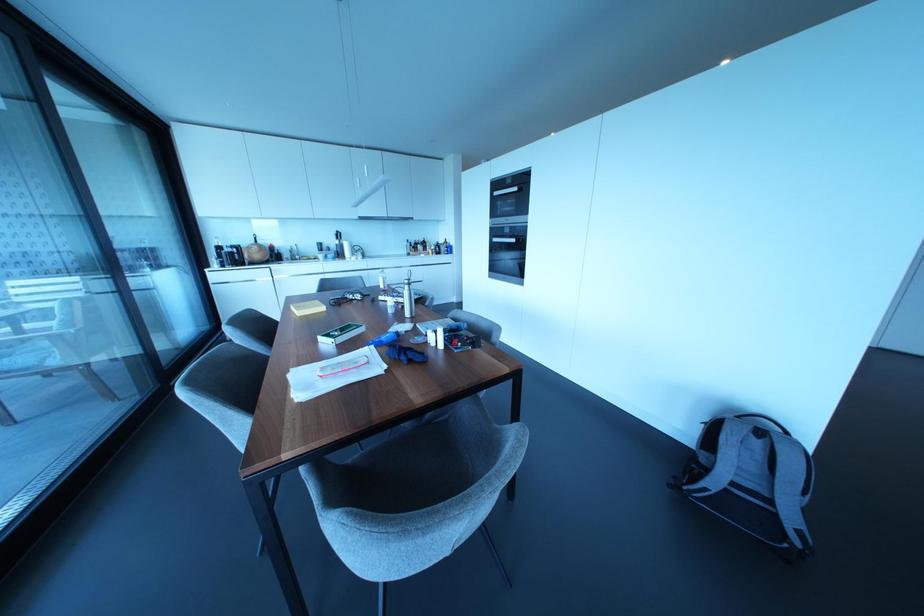
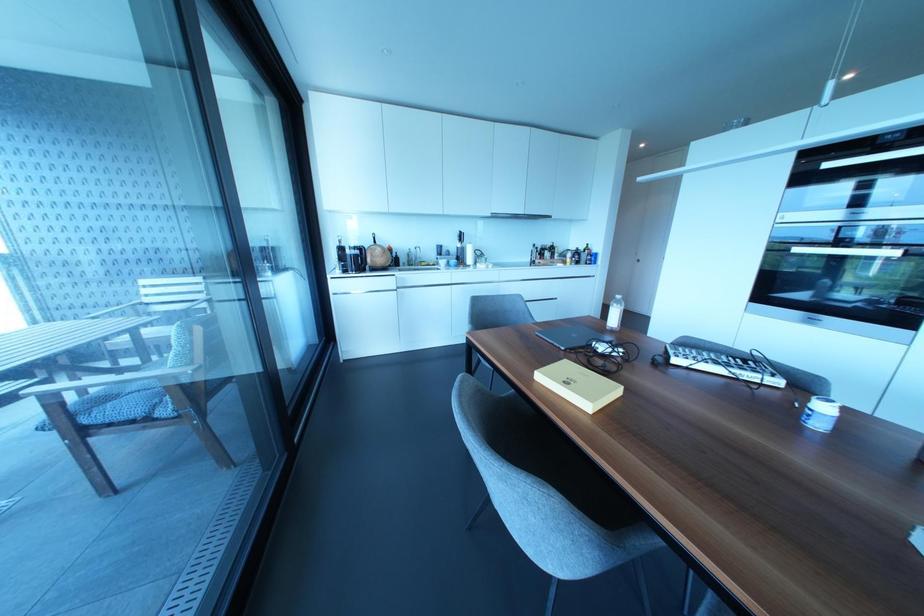
Which direction would the cameraman need to move to produce the second image?

The cameraman moved toward left, forward.